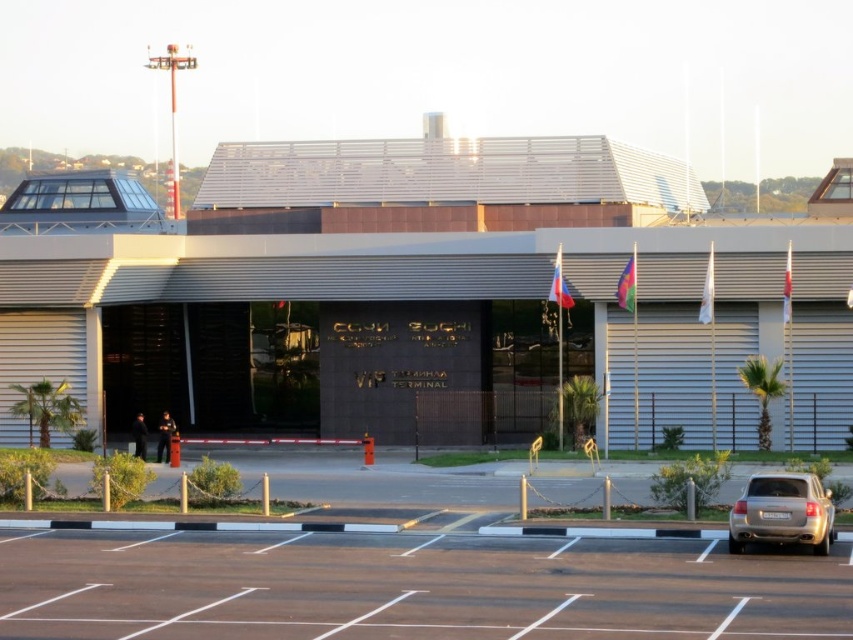
Question: Can you confirm if black asphalt parking lot at lower center is positioned to the right of silver metallic sedan at lower right?

Choices:
 (A) yes
 (B) no

Answer: (B)

Question: Can you confirm if green leafy palm tree at left is thinner than green leafy palm tree at center?

Choices:
 (A) no
 (B) yes

Answer: (A)

Question: From the image, what is the correct spatial relationship of green leafy palm tree at left in relation to green leafy palm tree at center?

Choices:
 (A) above
 (B) below

Answer: (B)

Question: Which of the following is the farthest from the observer?

Choices:
 (A) green leafy palm tree at right
 (B) green leafy palm tree at center
 (C) black asphalt parking lot at lower center
 (D) green leafy palm tree at left

Answer: (D)

Question: Which of the following is the closest to the observer?

Choices:
 (A) (581, 442)
 (B) (36, 413)

Answer: (A)

Question: Which is nearer to the green leafy palm tree at right?

Choices:
 (A) green leafy palm tree at center
 (B) green leafy palm tree at left

Answer: (A)